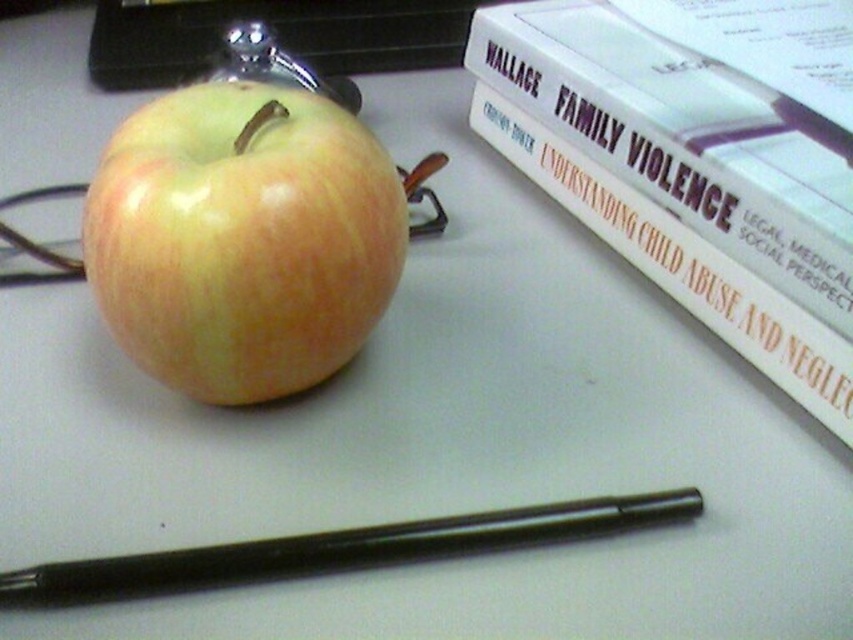
Question: Observing the image, what is the correct spatial positioning of hardcover book at upper right in reference to yellow matte apple at center?

Choices:
 (A) right
 (B) left

Answer: (A)

Question: Observing the image, what is the correct spatial positioning of hardcover book at upper right in reference to yellow matte apple at center?

Choices:
 (A) right
 (B) left

Answer: (A)

Question: Based on their relative distances, which object is nearer to the black matte pen at lower center?

Choices:
 (A) yellow matte apple at center
 (B) hardcover book at upper right

Answer: (A)

Question: Which point is farther from the camera taking this photo?

Choices:
 (A) [x=611, y=99]
 (B) [x=379, y=273]
 (C) [x=457, y=524]

Answer: (A)

Question: Is hardcover book at upper right below black matte pen at lower center?

Choices:
 (A) no
 (B) yes

Answer: (A)

Question: Which point is closer to the camera taking this photo?

Choices:
 (A) (714, 161)
 (B) (160, 337)

Answer: (B)